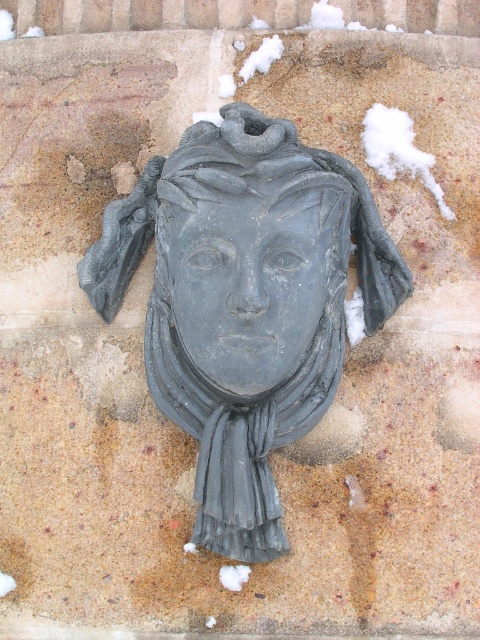
Who is higher up, matte gray stone head at center or matte gray stone face at center?

matte gray stone face at center is higher up.

Between matte gray stone head at center and matte gray stone face at center, which one has less height?

Standing shorter between the two is matte gray stone face at center.

Does point (387, 282) lie behind point (218, 294)?

Yes.

At what (x,y) coordinates should I click in order to perform the action: click on matte gray stone head at center. Please return your answer as a coordinate pair (x, y). This screenshot has height=640, width=480. Looking at the image, I should click on (244, 301).

Is point (265, 500) positioned in front of point (155, 381)?

That is True.

Does matte gray stone head at center lie in front of matte gray scarf at center?

Yes, matte gray stone head at center is closer to the viewer.

Which is in front, point (288, 332) or point (289, 419)?

Positioned in front is point (288, 332).

Identify the location of matte gray stone head at center. (244, 301).

Is matte gray stone face at center bigger than matte gray scarf at center?

No, matte gray stone face at center is not bigger than matte gray scarf at center.

Describe the element at coordinates (248, 285) in the screenshot. This screenshot has height=640, width=480. I see `matte gray stone face at center` at that location.

Is point (315, 317) positioned in front of point (215, 476)?

Yes, point (315, 317) is in front of point (215, 476).

Where is `matte gray stone face at center`? The image size is (480, 640). matte gray stone face at center is located at coordinates (248, 285).